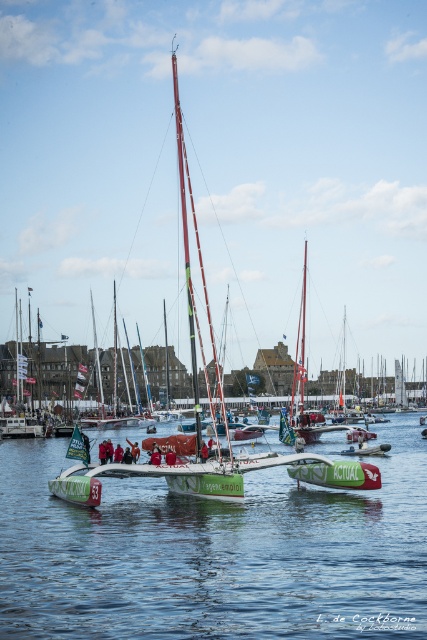
Question: In this image, where is green glossy water at center located relative to green matte sailboat at center?

Choices:
 (A) left
 (B) right

Answer: (B)

Question: Is green glossy water at center below green matte sailboat at center?

Choices:
 (A) no
 (B) yes

Answer: (B)

Question: Can you confirm if green glossy water at center is positioned above green matte sailboat at center?

Choices:
 (A) no
 (B) yes

Answer: (A)

Question: Which of the following is the closest to the observer?

Choices:
 (A) (216, 378)
 (B) (278, 476)

Answer: (B)

Question: Which of the following is the closest to the observer?

Choices:
 (A) green matte sailboat at center
 (B) green glossy water at center

Answer: (B)

Question: Which object appears closest to the camera in this image?

Choices:
 (A) green matte sailboat at center
 (B) green glossy water at center

Answer: (B)